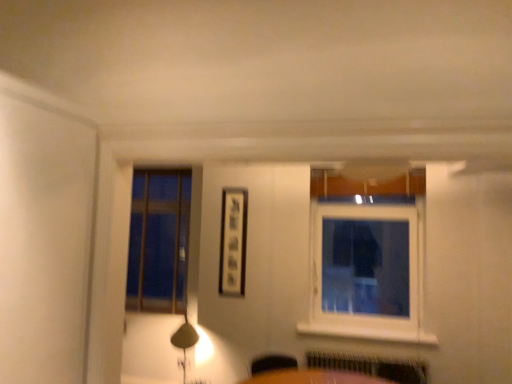
Find the location of a particular element. metallic silver radiator at lower center is located at coordinates (370, 366).

What do you see at coordinates (367, 258) in the screenshot? I see `white plastic window at upper right` at bounding box center [367, 258].

Image resolution: width=512 pixels, height=384 pixels. What do you see at coordinates (185, 340) in the screenshot? I see `matte gold table lamp at lower left` at bounding box center [185, 340].

This screenshot has width=512, height=384. I want to click on white painted wood at lower center, so click(368, 333).

From the image's perspective, is metallic silver radiator at lower center under white painted wood at lower center?

Correct, metallic silver radiator at lower center appears lower than white painted wood at lower center in the image.

Is metallic silver radiator at lower center behind white painted wood at lower center?

No, the depth of metallic silver radiator at lower center is less than that of white painted wood at lower center.

Are metallic silver radiator at lower center and white painted wood at lower center making contact?

metallic silver radiator at lower center and white painted wood at lower center are clearly separated.

From a real-world perspective, between matte black picture frame at center and metallic silver radiator at lower center, who is vertically lower?

metallic silver radiator at lower center is physically lower.

Is matte black picture frame at center at the right side of metallic silver radiator at lower center?

No.

Does point (233, 290) appear closer or farther from the camera than point (327, 355)?

Point (233, 290) is farther from the camera than point (327, 355).

Is matte black picture frame at center oriented away from metallic silver radiator at lower center?

No, matte black picture frame at center is not facing the opposite direction of metallic silver radiator at lower center.

From the image's perspective, is matte black picture frame at center located above or below matte gold table lamp at lower left?

matte black picture frame at center is situated higher than matte gold table lamp at lower left in the image.

Considering the relative positions of matte black picture frame at center and matte gold table lamp at lower left in the image provided, is matte black picture frame at center to the right of matte gold table lamp at lower left from the viewer's perspective?

Yes, matte black picture frame at center is to the right of matte gold table lamp at lower left.

Does matte black picture frame at center have a smaller size compared to matte gold table lamp at lower left?

Indeed, matte black picture frame at center has a smaller size compared to matte gold table lamp at lower left.

Are matte black picture frame at center and matte gold table lamp at lower left located far from each other?

No, matte black picture frame at center is in close proximity to matte gold table lamp at lower left.

Considering the sizes of objects white painted wood at lower center and matte gold table lamp at lower left in the image provided, who is wider, white painted wood at lower center or matte gold table lamp at lower left?

white painted wood at lower center.

From a real-world perspective, is white painted wood at lower center over matte gold table lamp at lower left?

Correct, in the physical world, white painted wood at lower center is higher than matte gold table lamp at lower left.

Does white painted wood at lower center appear on the left side of matte gold table lamp at lower left?

Incorrect, white painted wood at lower center is not on the left side of matte gold table lamp at lower left.

From the image's perspective, which is below, white painted wood at lower center or matte gold table lamp at lower left?

matte gold table lamp at lower left.

From the picture: Would you consider matte gold table lamp at lower left to be distant from white painted wood at lower center?

Yes, matte gold table lamp at lower left and white painted wood at lower center are quite far apart.

How far apart are matte gold table lamp at lower left and white painted wood at lower center?

matte gold table lamp at lower left is 1.45 meters from white painted wood at lower center.

Is matte gold table lamp at lower left taller or shorter than white painted wood at lower center?

matte gold table lamp at lower left is taller than white painted wood at lower center.

Can white painted wood at lower center be found inside matte gold table lamp at lower left?

That's incorrect, white painted wood at lower center is not inside matte gold table lamp at lower left.

Considering the sizes of objects white plastic window at upper right and matte black picture frame at center in the image provided, who is wider, white plastic window at upper right or matte black picture frame at center?

Wider between the two is white plastic window at upper right.

Based on the photo, can you see white plastic window at upper right touching matte black picture frame at center?

There is a gap between white plastic window at upper right and matte black picture frame at center.

Is white plastic window at upper right at the left side of matte black picture frame at center?

No, white plastic window at upper right is not to the left of matte black picture frame at center.

Looking at this image, considering the positions of objects white plastic window at upper right and matte black picture frame at center in the image provided, who is in front, white plastic window at upper right or matte black picture frame at center?

white plastic window at upper right is more forward.

How different are the orientations of metallic silver radiator at lower center and matte gold table lamp at lower left in degrees?

metallic silver radiator at lower center and matte gold table lamp at lower left are facing 4.95 degrees away from each other.

Looking at this image, from the image's perspective, between metallic silver radiator at lower center and matte gold table lamp at lower left, who is located below?

metallic silver radiator at lower center is shown below in the image.

Would you say metallic silver radiator at lower center is outside matte gold table lamp at lower left?

Yes, metallic silver radiator at lower center is outside of matte gold table lamp at lower left.

At what (x,y) coordinates should I click in order to perform the action: click on radiator lying on the left of white painted wood at lower center. Please return your answer as a coordinate pair (x, y). This screenshot has height=384, width=512. Looking at the image, I should click on (370, 366).

Locate an element on the screen. radiator that is in front of the matte black picture frame at center is located at coordinates (370, 366).

Looking at the image, which one is located further to white plastic window at upper right, metallic silver radiator at lower center or white painted wood at lower center?

The object further to white plastic window at upper right is metallic silver radiator at lower center.

Which object lies further to the anchor point metallic silver radiator at lower center, white plastic window at upper right or matte gold table lamp at lower left?

matte gold table lamp at lower left lies further to metallic silver radiator at lower center than the other object.

Estimate the real-world distances between objects in this image. Which object is further from white plastic window at upper right, matte gold table lamp at lower left or matte black picture frame at center?

matte gold table lamp at lower left.

When comparing their distances from white plastic window at upper right, does matte black picture frame at center or metallic silver radiator at lower center seem closer?

metallic silver radiator at lower center.

Estimate the real-world distances between objects in this image. Which object is closer to white painted wood at lower center, matte black picture frame at center or white plastic window at upper right?

Based on the image, white plastic window at upper right appears to be nearer to white painted wood at lower center.

Based on their spatial positions, is white plastic window at upper right or matte gold table lamp at lower left closer to matte black picture frame at center?

Among the two, matte gold table lamp at lower left is located nearer to matte black picture frame at center.

Based on the photo, when comparing their distances from matte gold table lamp at lower left, does metallic silver radiator at lower center or white painted wood at lower center seem closer?

metallic silver radiator at lower center lies closer to matte gold table lamp at lower left than the other object.

Based on their spatial positions, is metallic silver radiator at lower center or matte black picture frame at center closer to white painted wood at lower center?

Based on the image, metallic silver radiator at lower center appears to be nearer to white painted wood at lower center.

The image size is (512, 384). Identify the location of window sill between matte black picture frame at center and white plastic window at upper right. (368, 333).

Identify the location of radiator located between matte black picture frame at center and white painted wood at lower center in the left-right direction. (370, 366).

Where is `window sill between white plastic window at upper right and metallic silver radiator at lower center in the vertical direction`? The width and height of the screenshot is (512, 384). window sill between white plastic window at upper right and metallic silver radiator at lower center in the vertical direction is located at coordinates (368, 333).

Where is `picture frame situated between matte gold table lamp at lower left and white plastic window at upper right from left to right`? picture frame situated between matte gold table lamp at lower left and white plastic window at upper right from left to right is located at coordinates (233, 242).